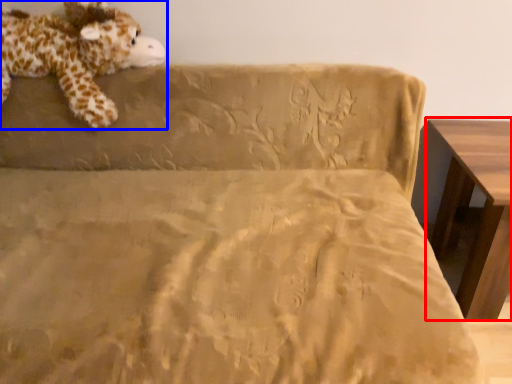
Question: Which object is closer to the camera taking this photo, table (highlighted by a red box) or animal (highlighted by a blue box)?

Choices:
 (A) table
 (B) animal

Answer: (A)